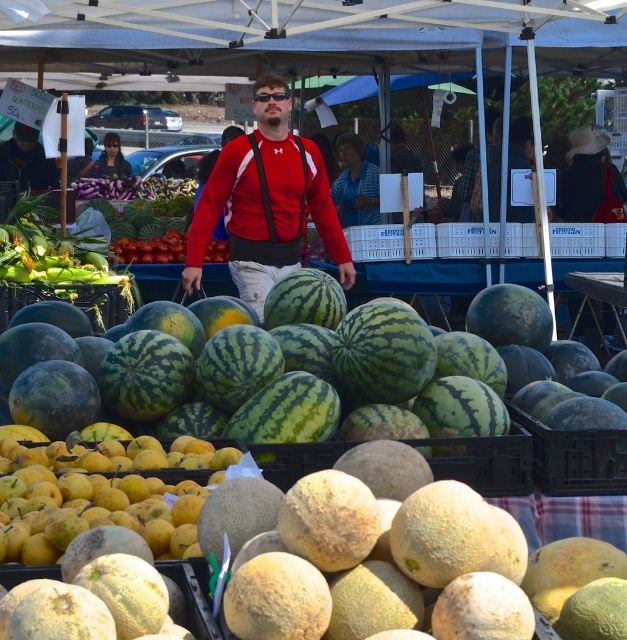
Question: Is the position of green striped watermelon at center less distant than that of matte red jacket at center?

Choices:
 (A) yes
 (B) no

Answer: (A)

Question: Which point is farther to the camera?

Choices:
 (A) green striped watermelon at center
 (B) matte red jacket at center

Answer: (B)

Question: Which of the following is the closest to the observer?

Choices:
 (A) green striped watermelon at center
 (B) matte red jacket at center

Answer: (A)

Question: Can you confirm if green striped watermelon at center is thinner than matte red jacket at center?

Choices:
 (A) no
 (B) yes

Answer: (A)

Question: From the image, what is the correct spatial relationship of green striped watermelon at center in relation to matte red jacket at center?

Choices:
 (A) below
 (B) above

Answer: (A)